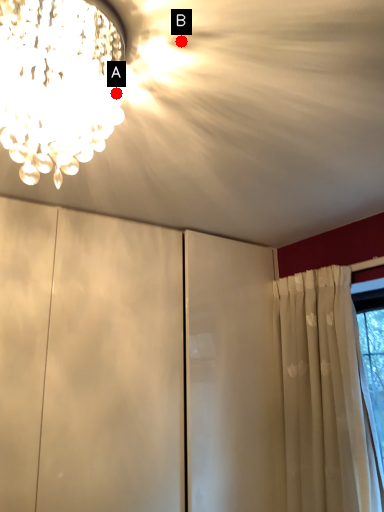
Question: Two points are circled on the image, labeled by A and B beside each circle. Which point is farther from the camera taking this photo?

Choices:
 (A) A is further
 (B) B is further

Answer: (A)